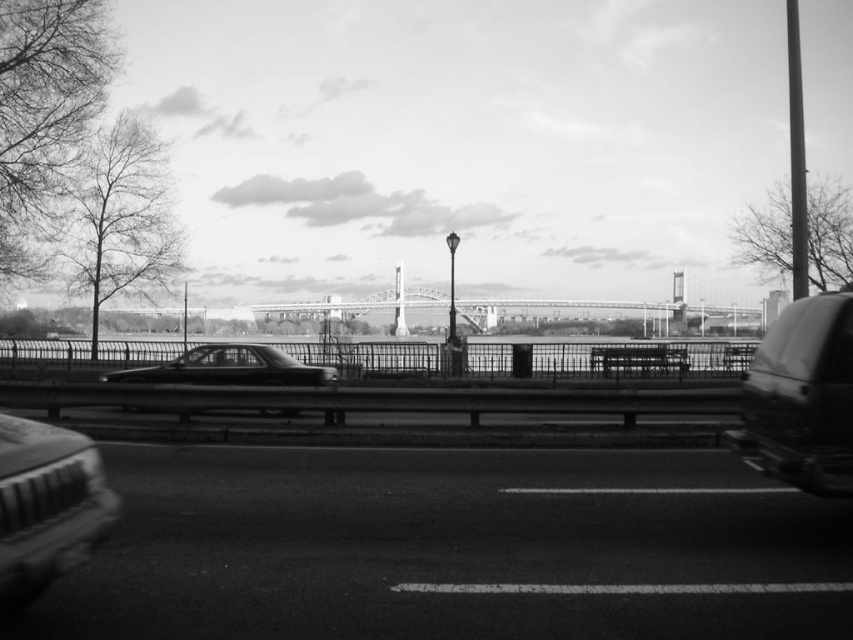
You are a delivery driver who needs to make a quick U turn on the asphalt road at center. Considering the shiny black sedan at center is parked there, can you safely perform the U turn without crossing the road?

The asphalt road at center is thinner than the shiny black sedan at center, so there might not be enough space to safely perform a U turn without crossing the road. It is recommended to look for an alternative route or a wider area to execute the maneuver safely.

You are standing at the point labeled as point (801, 397) in the image. What object are you facing?

The point labeled as point (801, 397) indicates the metallic gray car at right, so you are facing the metallic gray car at right.

You are a photographer trying to capture both the metallic silver car at lower left and the shiny black sedan at center in a single frame. Based on their sizes in the image, which car will appear smaller?

The metallic silver car at lower left appears smaller than the shiny black sedan at center because its width is less than the sedan.